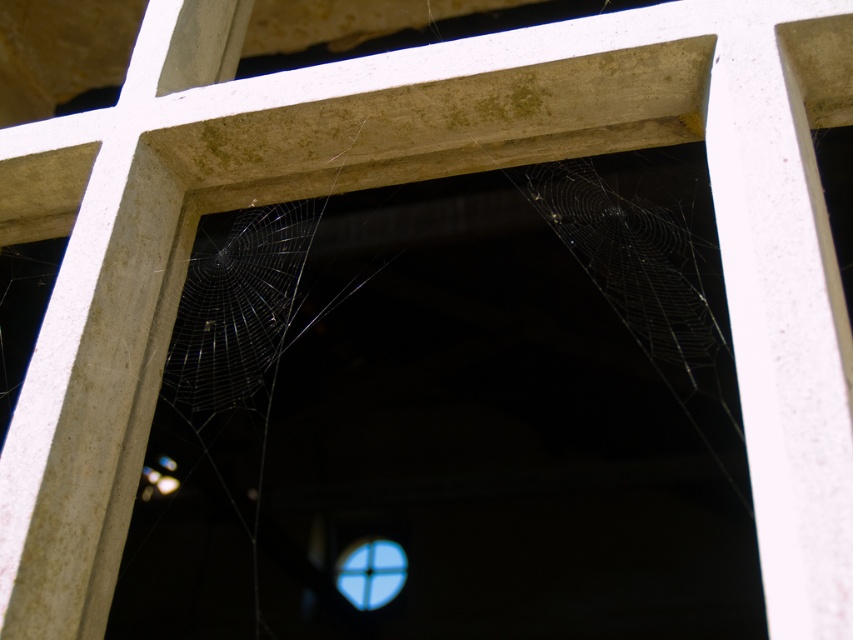
Between point (178, 349) and point (378, 573), which one is positioned in front?

Point (178, 349)

Who is shorter, transparent silk web at center or transparent glass window at center?

With less height is transparent glass window at center.

Does point (199, 285) come in front of point (366, 582)?

Yes, point (199, 285) is closer to viewer.

Identify the location of transparent silk web at center. (236, 307).